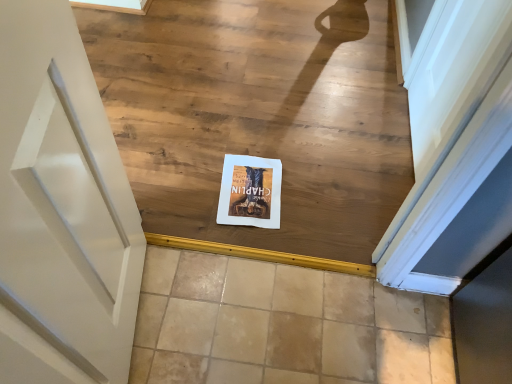
Question: Is matte paper postcard at center to the left of beige tile at center from the viewer's perspective?

Choices:
 (A) yes
 (B) no

Answer: (A)

Question: Does matte paper postcard at center have a lesser height compared to beige tile at center?

Choices:
 (A) yes
 (B) no

Answer: (A)

Question: From a real-world perspective, is matte paper postcard at center below beige tile at center?

Choices:
 (A) yes
 (B) no

Answer: (B)

Question: Can you confirm if matte paper postcard at center is wider than beige tile at center?

Choices:
 (A) yes
 (B) no

Answer: (B)

Question: Are matte paper postcard at center and beige tile at center located far from each other?

Choices:
 (A) yes
 (B) no

Answer: (B)

Question: Is matte paper postcard at center closer to camera compared to beige tile at center?

Choices:
 (A) yes
 (B) no

Answer: (B)

Question: Does white paper at center have a greater height compared to beige tile at center?

Choices:
 (A) yes
 (B) no

Answer: (A)

Question: Considering the relative sizes of white paper at center and beige tile at center in the image provided, is white paper at center shorter than beige tile at center?

Choices:
 (A) no
 (B) yes

Answer: (A)

Question: From the image's perspective, would you say white paper at center is positioned over beige tile at center?

Choices:
 (A) no
 (B) yes

Answer: (B)

Question: Is white paper at center directly adjacent to beige tile at center?

Choices:
 (A) yes
 (B) no

Answer: (B)

Question: Could you tell me if white paper at center is facing beige tile at center?

Choices:
 (A) yes
 (B) no

Answer: (A)

Question: Is white paper at center located outside beige tile at center?

Choices:
 (A) yes
 (B) no

Answer: (A)

Question: Is beige tile at center to the left of white paper at center from the viewer's perspective?

Choices:
 (A) no
 (B) yes

Answer: (A)